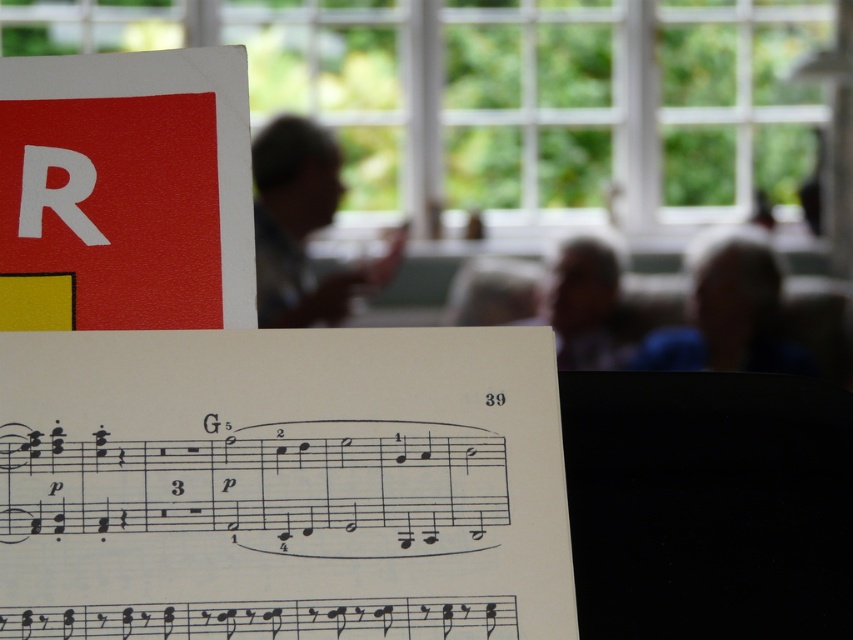
Can you confirm if white paper sheet music at center is positioned below matte plastic cup at upper center?

Yes.

Is white paper sheet music at center to the right of matte plastic cup at upper center from the viewer's perspective?

Correct, you'll find white paper sheet music at center to the right of matte plastic cup at upper center.

At what (x,y) coordinates should I click in order to perform the action: click on white paper sheet music at center. Please return your answer as a coordinate pair (x, y). Image resolution: width=853 pixels, height=640 pixels. Looking at the image, I should click on (282, 484).

Locate an element on the screen. The width and height of the screenshot is (853, 640). white paper sheet music at center is located at coordinates (282, 484).